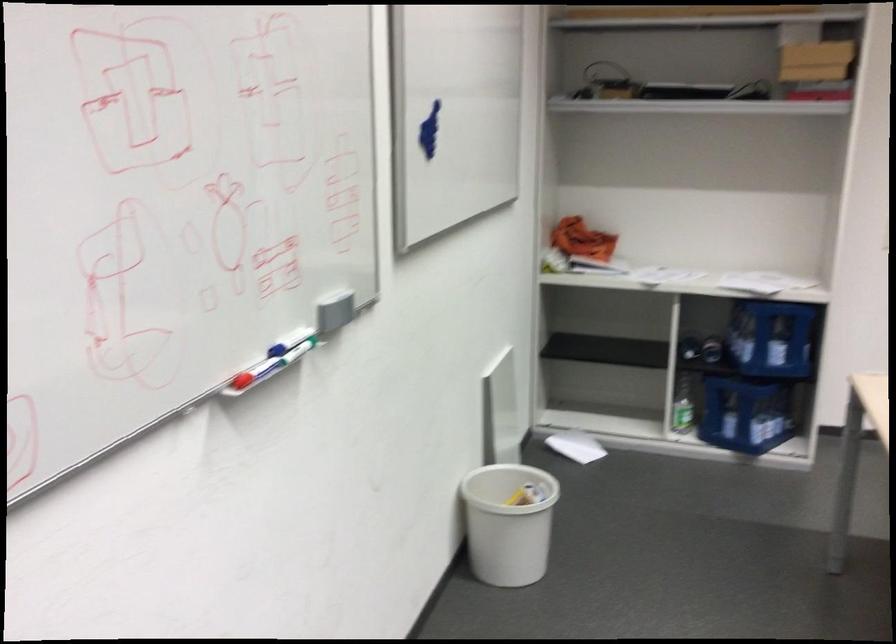
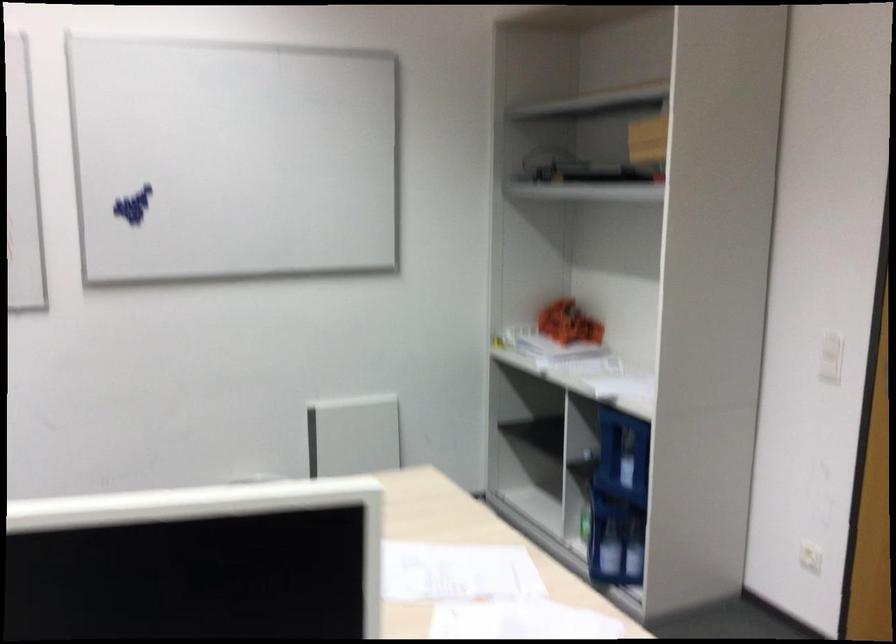
Question: I am providing you with two images of the same scene from different viewpoints. Which of the following objects are not visible in image2?

Choices:
 (A) blue bottle crate
 (B) glass water bottle
 (C) elliptical foot pedal
 (D) green glass bottle

Answer: (D)